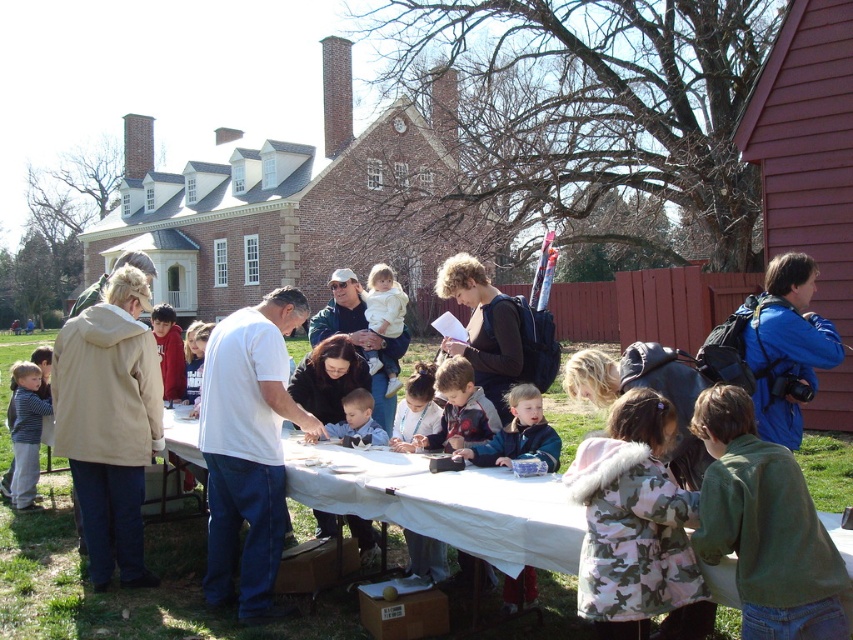
You are a guest at this event and want to pick up your jacket from the table. Both the dark brown leather jacket at center and the light blue fleece jacket at center are on the table. Which one is bigger?

The dark brown leather jacket at center is larger in size compared to the light blue fleece jacket at center.

You are a photographer standing at the edge of the grassy area where the long table is set up. You want to take a photo that includes both the camo coat at lower right and the light blue fleece jacket at center. Given that your camera has a maximum focus range of 1.5 meters, will you be able to capture both items in focus without moving your position?

The distance between the camo coat at lower right and the light blue fleece jacket at center is 1.67 meters. Since your camera can only focus within 1.5 meters, you won

You are a photographer at the event and need to capture a photo of the white cotton shirt at center without the striped shirt at lower left appearing in the foreground. Is this possible given their positions?

The striped shirt at lower left is positioned under the white cotton shirt at center, so adjusting the camera angle to focus on the white cotton shirt at center from above would prevent the striped shirt at lower left from appearing in the foreground.